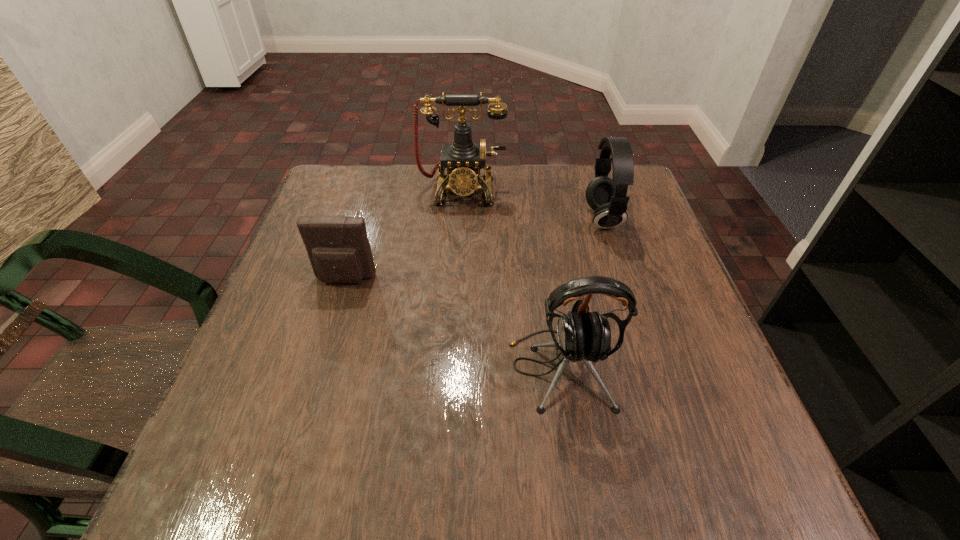
The width and height of the screenshot is (960, 540). In the image, there is a desktop. What are the coordinates of `vacant space at the left edge` in the screenshot? It's located at (264, 401).

Locate an element on the screen. This screenshot has width=960, height=540. free region at the right edge is located at coordinates (651, 296).

Locate an element on the screen. free space at the far left corner of the desktop is located at coordinates (386, 168).

The height and width of the screenshot is (540, 960). Identify the location of vacant region at the far right corner of the desktop. (581, 175).

In order to click on blank space at the near right corner of the desktop in this screenshot , I will do `click(714, 446)`.

Where is `free space between the right earphone and the telephone`? The height and width of the screenshot is (540, 960). free space between the right earphone and the telephone is located at coordinates pos(532,204).

At what (x,y) coordinates should I click in order to perform the action: click on empty location between the nearest object and the telephone. Please return your answer as a coordinate pair (x, y). Image resolution: width=960 pixels, height=540 pixels. Looking at the image, I should click on (511, 280).

What are the coordinates of `vacant space that's between the shortest object and the nearer earphone` in the screenshot? It's located at (453, 324).

I want to click on free space between the left earphone and the pouch, so click(453, 324).

Image resolution: width=960 pixels, height=540 pixels. I want to click on free space between the nearer earphone and the pouch, so click(x=453, y=324).